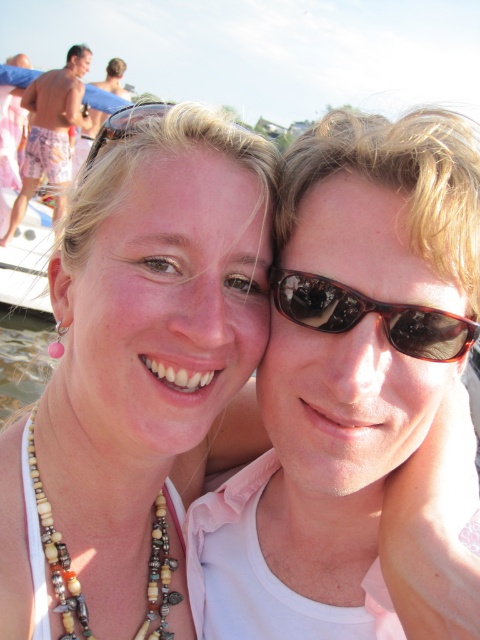
You are a photographer standing at the center of the scene. You want to take a photo that includes both the shiny pink shorts at left and the matte black sunglasses at upper left. How far apart are these two items from each other in feet?

The shiny pink shorts at left is 23.28 feet away from matte black sunglasses at upper left.

You are a photographer trying to focus on the shiny pink shorts at left. However, the brown reflective sunglasses at center is blocking your view. Can you adjust your camera angle to capture the shorts without the sunglasses in the frame?

The brown reflective sunglasses at center is in front of the shiny pink shorts at left, so adjusting the camera angle to look slightly behind or around the sunglasses should allow you to capture the shorts without the sunglasses blocking the view.